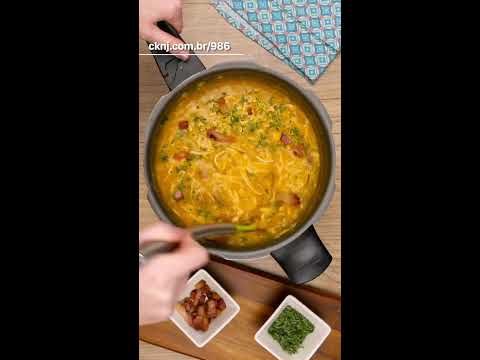
Find the location of a particular element. pot is located at coordinates (329, 198).